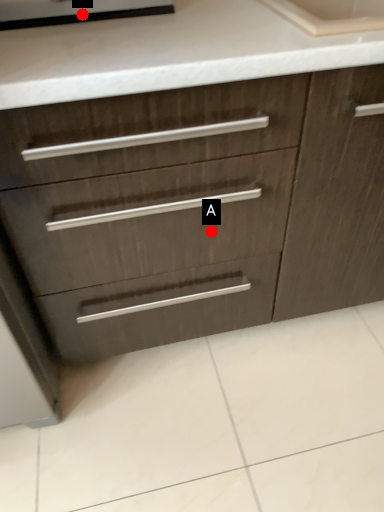
Question: Two points are circled on the image, labeled by A and B beside each circle. Which point is farther from the camera taking this photo?

Choices:
 (A) A is further
 (B) B is further

Answer: (A)